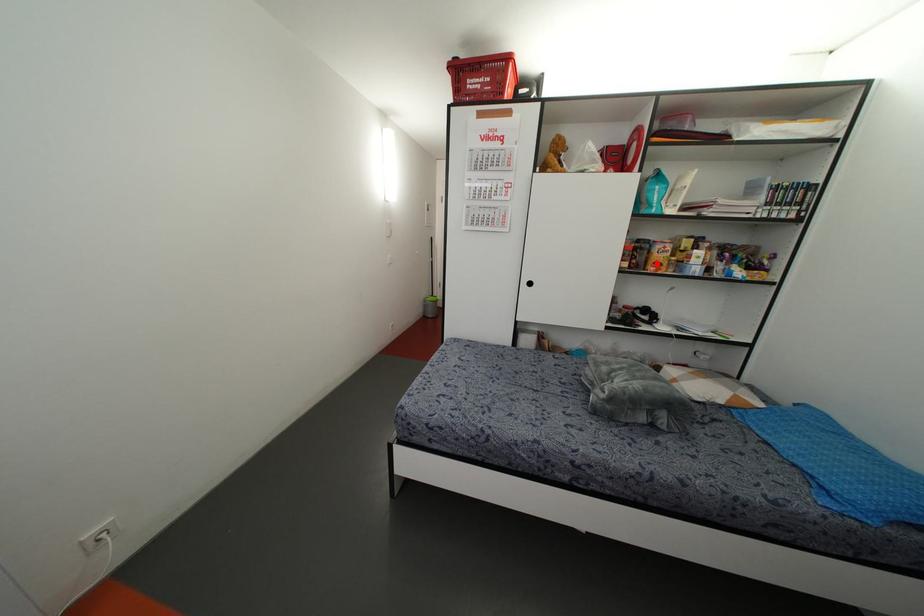
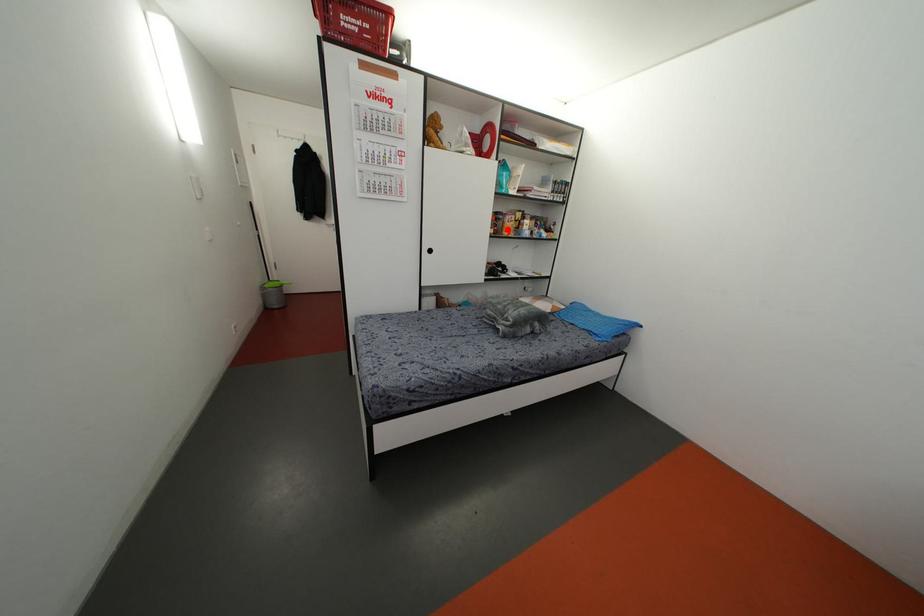
I am providing you with two images of the same scene from different viewpoints. A red point is marked on the first image and another point is marked on the second image. Is the marked point in image1 the same physical position as the marked point in image2?

Yes